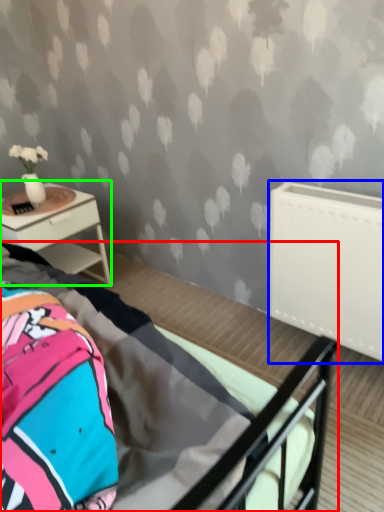
Question: Which is farther away from bed (highlighted by a red box)? radiator (highlighted by a blue box) or nightstand (highlighted by a green box)?

Choices:
 (A) radiator
 (B) nightstand

Answer: (B)